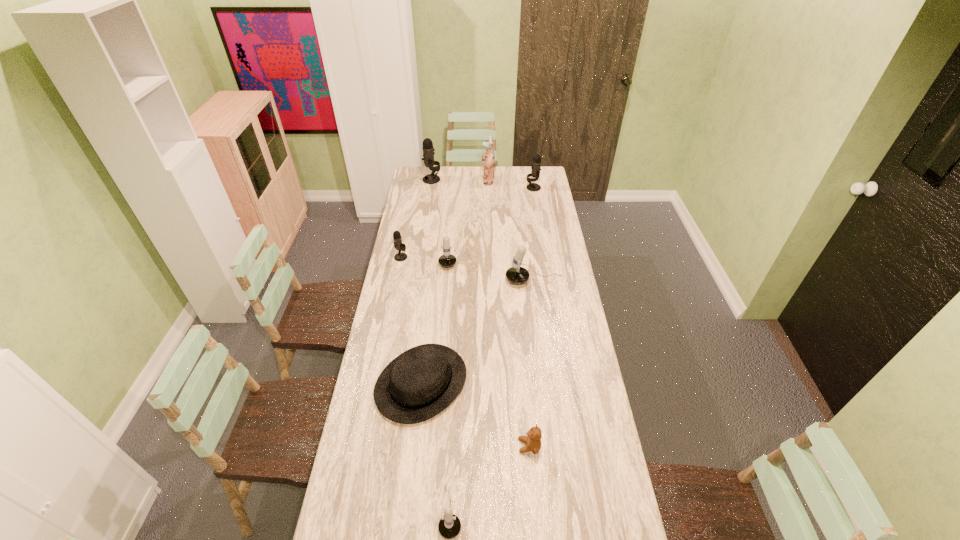
This screenshot has height=540, width=960. What are the coordinates of `object that is the sixth closest to the second farthest white microphone` in the screenshot? It's located at (488, 159).

Select which microphone appears as the fourth closest to the rightmost black microphone. Please provide its 2D coordinates. Your answer should be formatted as a tuple, i.e. [(x, y)], where the tuple contains the x and y coordinates of a point satisfying the conditions above.

[(398, 244)]

Identify which microphone is located as the fifth nearest to the rightmost black microphone. Please provide its 2D coordinates. Your answer should be formatted as a tuple, i.e. [(x, y)], where the tuple contains the x and y coordinates of a point satisfying the conditions above.

[(449, 526)]

Select which black microphone appears as the second closest to the black fedora. Please provide its 2D coordinates. Your answer should be formatted as a tuple, i.e. [(x, y)], where the tuple contains the x and y coordinates of a point satisfying the conditions above.

[(536, 163)]

Identify which black microphone is located as the nearest to the leftmost black microphone. Please provide its 2D coordinates. Your answer should be formatted as a tuple, i.e. [(x, y)], where the tuple contains the x and y coordinates of a point satisfying the conditions above.

[(428, 150)]

Where is `white microphone that is the closest to the teddy bear`? white microphone that is the closest to the teddy bear is located at coordinates (449, 526).

Locate which white microphone is the third closest to the pink figurine. Please provide its 2D coordinates. Your answer should be formatted as a tuple, i.e. [(x, y)], where the tuple contains the x and y coordinates of a point satisfying the conditions above.

[(449, 526)]

You are a GUI agent. You are given a task and a screenshot of the screen. Output one action in this format:
    pyautogui.click(x=<x>, y=<y>)
    Task: Click on the blank space that satisfies the following two spatial constraints: 1. on the front side of the second biggest black microphone; 2. on the front-facing side of the teddy bear
    This screenshot has width=960, height=540.
    Given the screenshot: What is the action you would take?
    pyautogui.click(x=576, y=446)